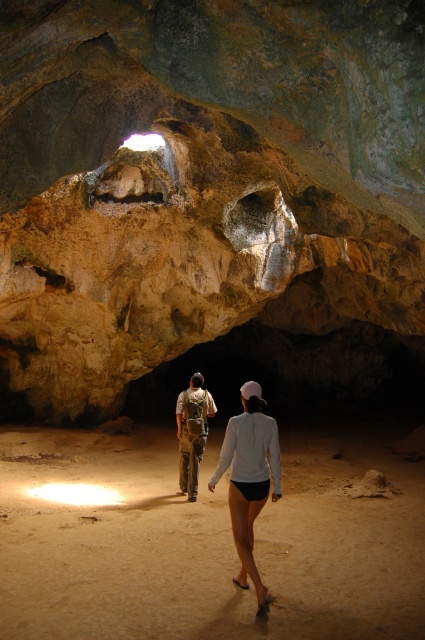
You are a photographer trying to capture a clear image of both the white matte shorts at center and the camouflage fabric backpack at center in the cave. Since the cave is dimly lit, you need to adjust your camera settings to ensure both objects are visible. Considering their sizes, which object might require more focus adjustment due to its size?

The white matte shorts at center has a larger width than the camouflage fabric backpack at center, so it might require more focus adjustment due to its size.